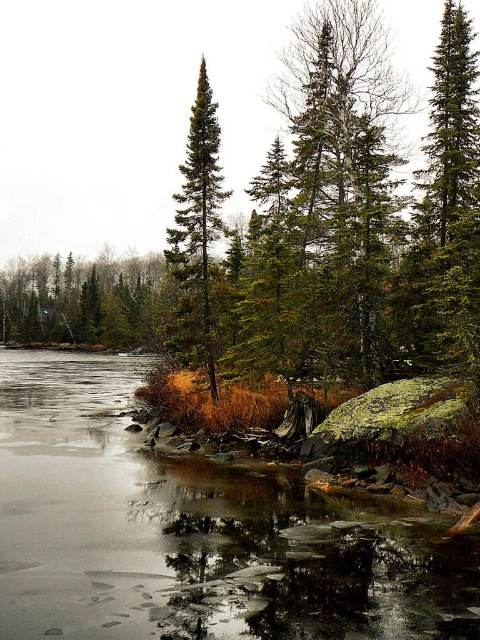
Question: Considering the real-world distances, which object is farthest from the green matte tree at center?

Choices:
 (A) green matte evergreen tree at upper right
 (B) smooth ice at lower left
 (C) green matte tree at upper left

Answer: (C)

Question: Can you confirm if smooth ice at lower left is positioned below green matte tree at upper left?

Choices:
 (A) yes
 (B) no

Answer: (A)

Question: Does green matte evergreen tree at upper right have a larger size compared to green matte tree at upper left?

Choices:
 (A) yes
 (B) no

Answer: (B)

Question: Is green matte tree at upper left to the left of green matte tree at center from the viewer's perspective?

Choices:
 (A) no
 (B) yes

Answer: (B)

Question: Which point is closer to the camera taking this photo?

Choices:
 (A) (20, 282)
 (B) (457, 61)

Answer: (B)

Question: Which point is closer to the camera?

Choices:
 (A) (275, 488)
 (B) (437, 304)

Answer: (A)